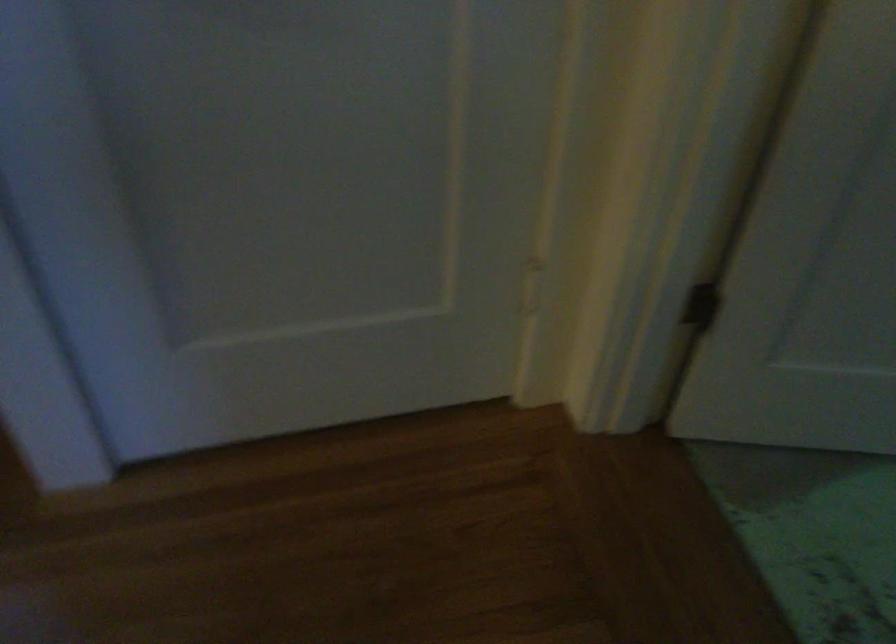
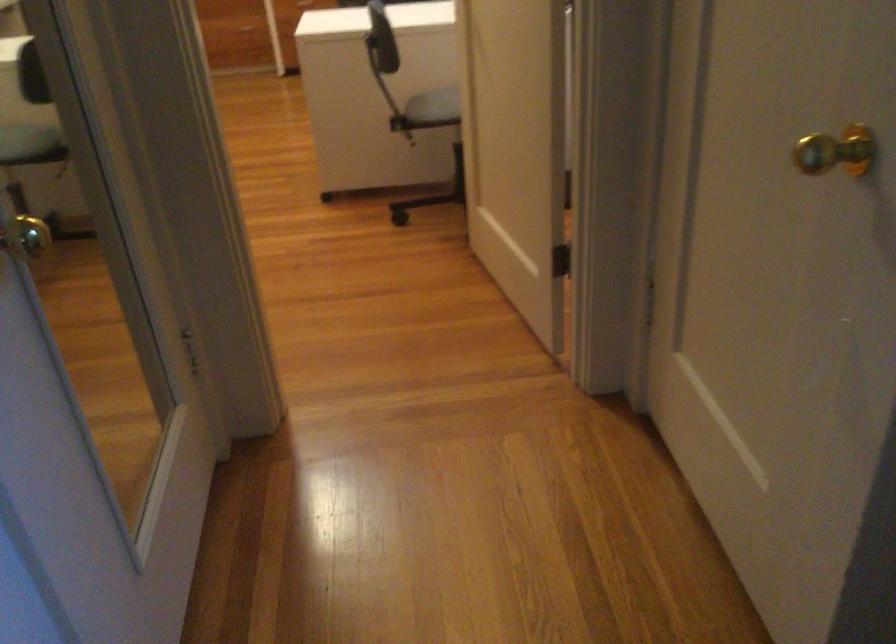
Based on the continuous images, in which direction is the camera rotating?

The rotation direction of the camera is left-down.